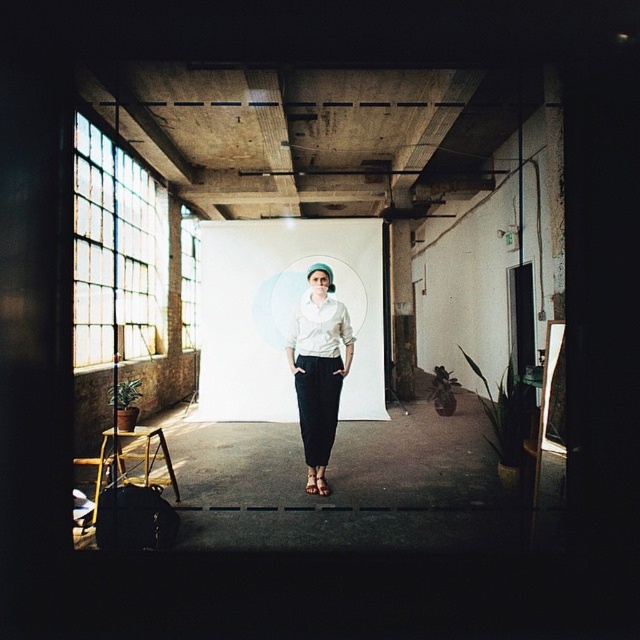
Question: Which object appears farthest from the camera in this image?

Choices:
 (A) white matte shirt at center
 (B) white matte blouse at center

Answer: (B)

Question: Which object is positioned farthest from the matte pink sandal at center?

Choices:
 (A) white matte blouse at center
 (B) white matte shirt at center

Answer: (A)

Question: Which object is farther from the camera taking this photo?

Choices:
 (A) matte pink sandal at center
 (B) brown leather sandal at center

Answer: (B)

Question: Is white matte shirt at center positioned before brown leather sandal at center?

Choices:
 (A) yes
 (B) no

Answer: (B)

Question: Can you confirm if white matte blouse at center is wider than matte pink sandal at center?

Choices:
 (A) no
 (B) yes

Answer: (B)

Question: Is white matte shirt at center below brown leather sandal at center?

Choices:
 (A) no
 (B) yes

Answer: (A)